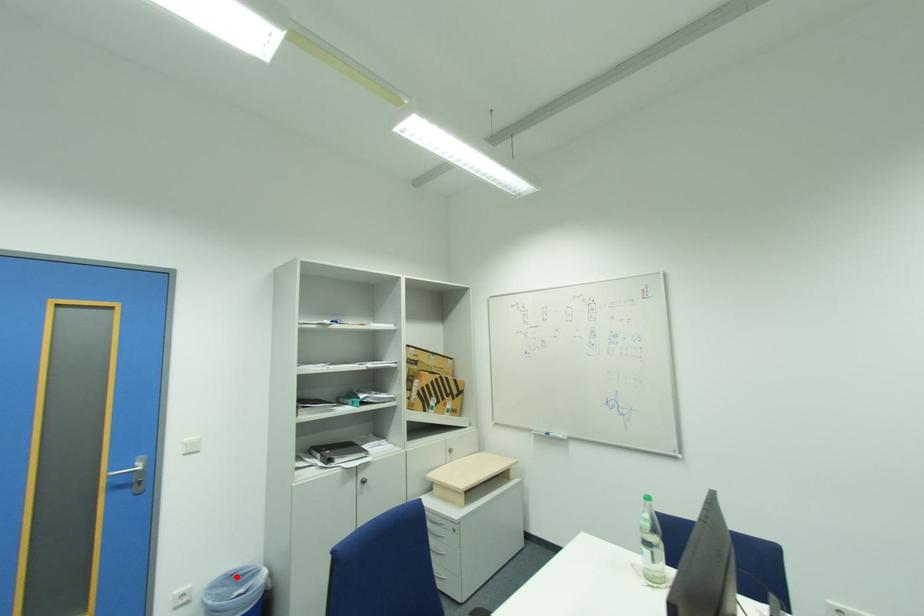
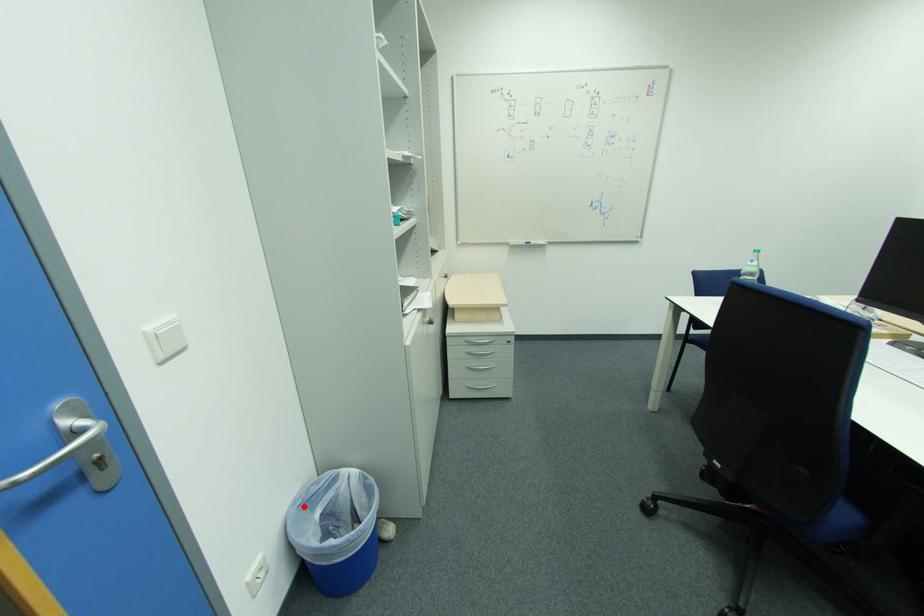
I am providing you with two images of the same scene from different viewpoints. A red point is marked on the first image and another point is marked on the second image. Do the highlighted points in image1 and image2 indicate the same real-world spot?

Yes